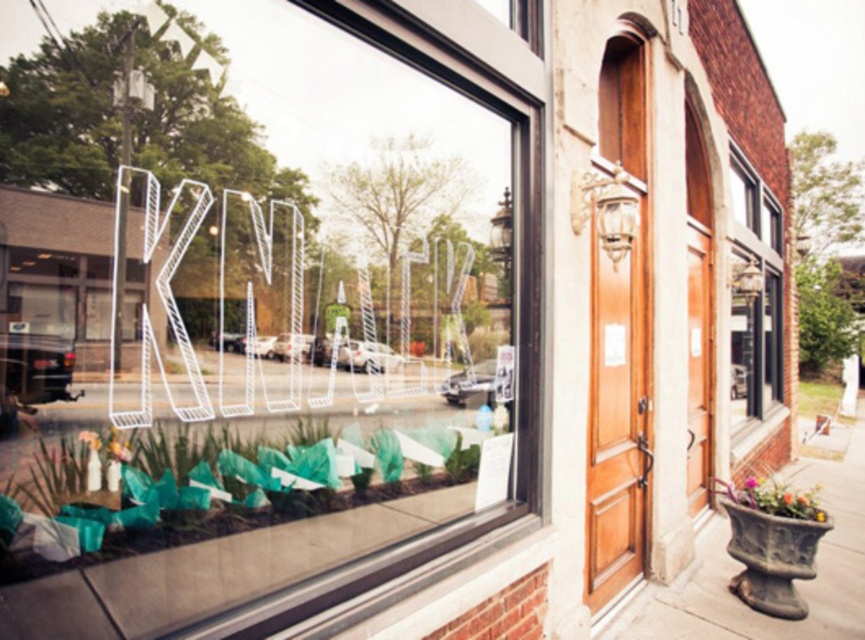
Question: Among these objects, which one is nearest to the camera?

Choices:
 (A) multicolored ceramic pot at lower right
 (B) smooth concrete pavement at lower right

Answer: (B)

Question: Which of the following is the farthest from the observer?

Choices:
 (A) multicolored ceramic pot at lower right
 (B) green leafy plant at lower left

Answer: (A)

Question: Which object appears farthest from the camera in this image?

Choices:
 (A) multicolored ceramic pot at lower right
 (B) white wire lettering at center

Answer: (A)

Question: In this image, where is green leafy plant at lower left located relative to clear glass window at upper right?

Choices:
 (A) right
 (B) left

Answer: (B)

Question: Can you confirm if smooth concrete pavement at lower right is positioned to the left of clear glass window at upper right?

Choices:
 (A) no
 (B) yes

Answer: (B)

Question: Can you confirm if white wire lettering at center is positioned to the right of multicolored ceramic pot at lower right?

Choices:
 (A) no
 (B) yes

Answer: (A)